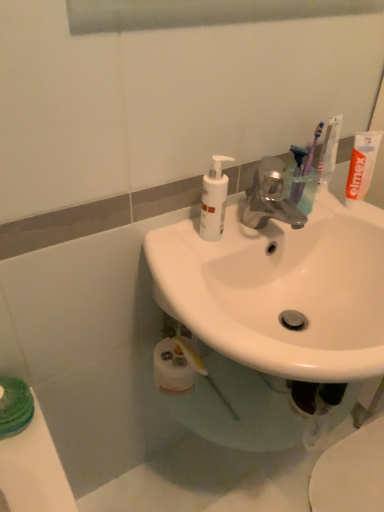
This screenshot has height=512, width=384. In order to click on free space that is in between white matte pump bottle at upper center and translucent plastic toothbrush at upper right, placed as the first toothbrush when sorted from left to right in this screenshot , I will do 248,221.